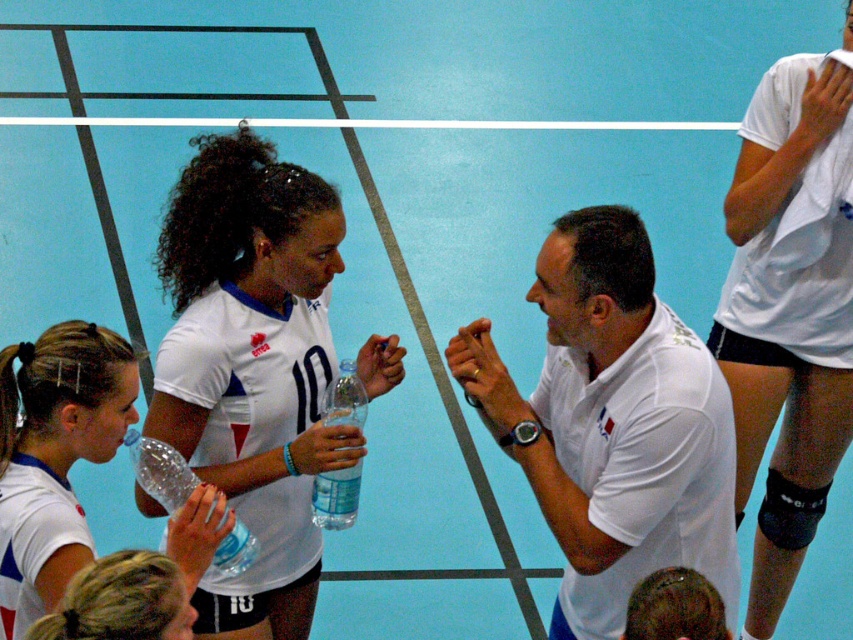
Question: Where is clear plastic water bottle at lower left located in relation to clear plastic bottle at center in the image?

Choices:
 (A) below
 (B) above

Answer: (B)

Question: Observing the image, what is the correct spatial positioning of white matte jersey at center in reference to white matte shirt at center?

Choices:
 (A) above
 (B) below

Answer: (A)

Question: Which is farther from the white matte knee pad at upper right?

Choices:
 (A) transparent plastic bottle at center
 (B) clear plastic water bottle at lower left

Answer: (B)

Question: Which point is farther from the camera taking this photo?

Choices:
 (A) (230, 563)
 (B) (625, 252)

Answer: (B)

Question: Which object is farther from the camera taking this photo?

Choices:
 (A) white matte jersey at center
 (B) white matte shirt at center
 (C) clear plastic water bottle at lower left
 (D) transparent plastic bottle at center

Answer: (A)

Question: Is white matte jersey at center bigger than white matte knee pad at upper right?

Choices:
 (A) yes
 (B) no

Answer: (B)